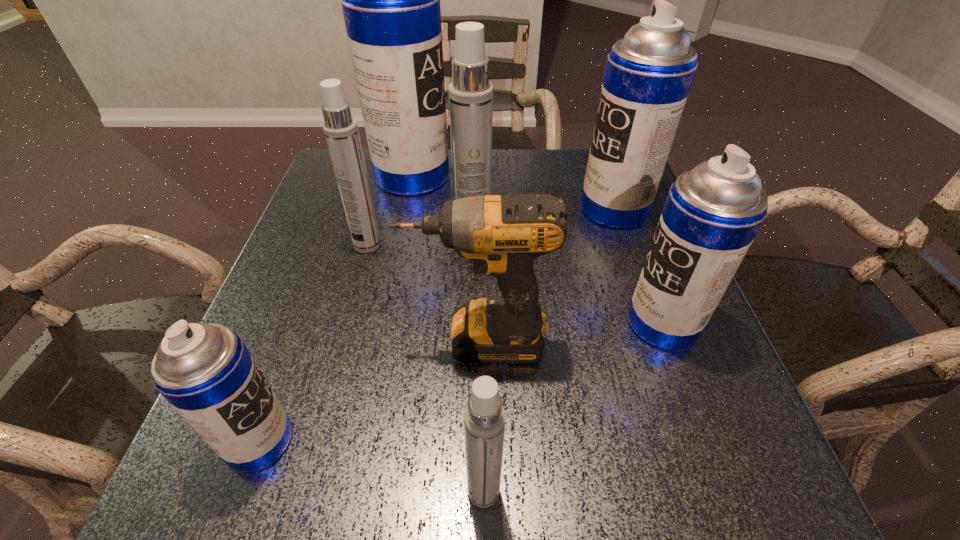
Identify which white aerosol can is the second closest to the biggest white aerosol can. Please provide its 2D coordinates. Your answer should be formatted as a tuple, i.e. [(x, y)], where the tuple contains the x and y coordinates of a point satisfying the conditions above.

[(484, 416)]

At what (x,y) coordinates should I click in order to perform the action: click on vacant space that satisfies the following two spatial constraints: 1. with the drill bit of the drill facing forward; 2. on the left side of the nearest aerosol can. Please return your answer as a coordinate pair (x, y). The height and width of the screenshot is (540, 960). Looking at the image, I should click on (476, 491).